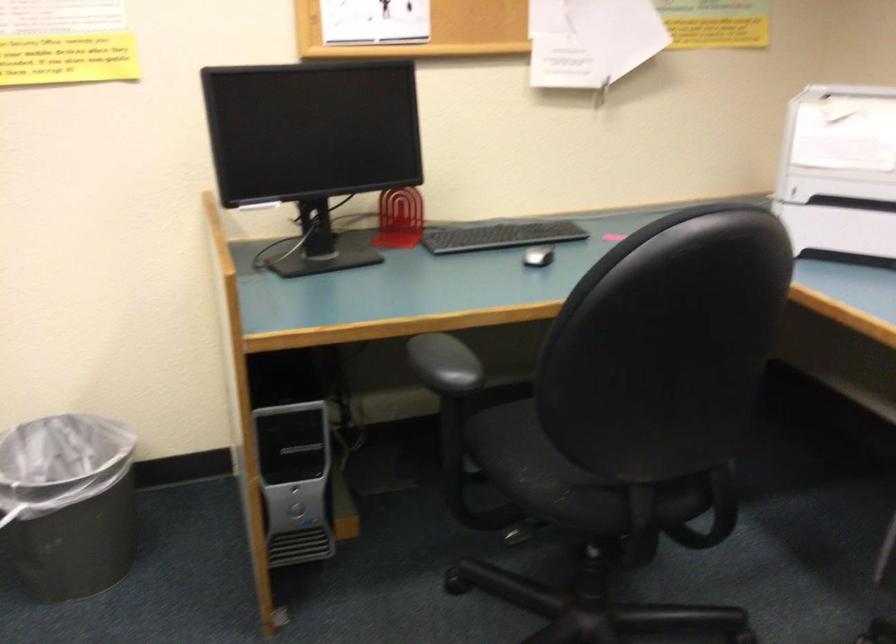
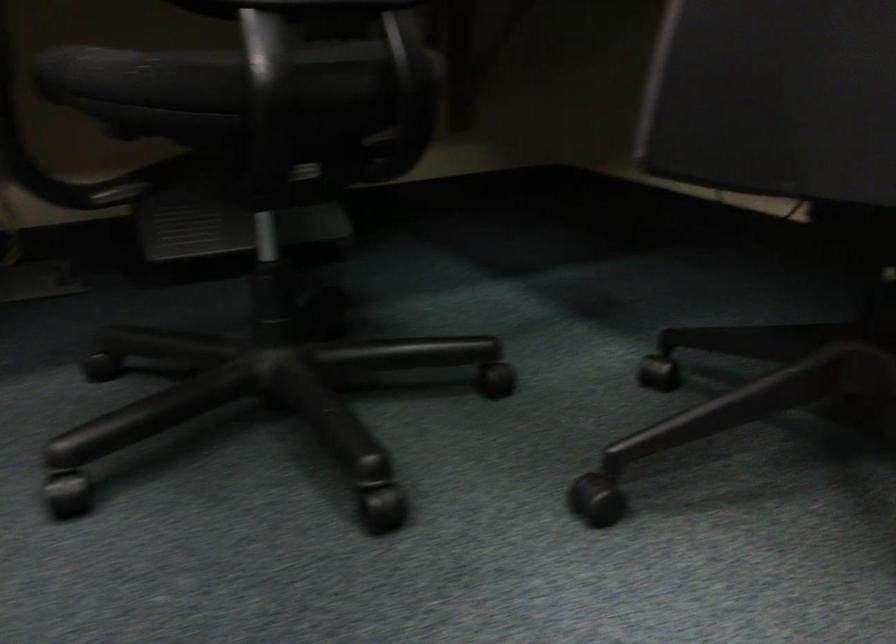
Question: The camera is either moving clockwise (left) or counter-clockwise (right) around the object. The first image is from the beginning of the video and the second image is from the end. Is the camera moving left or right when shooting the video?

Choices:
 (A) Left
 (B) Right

Answer: (A)